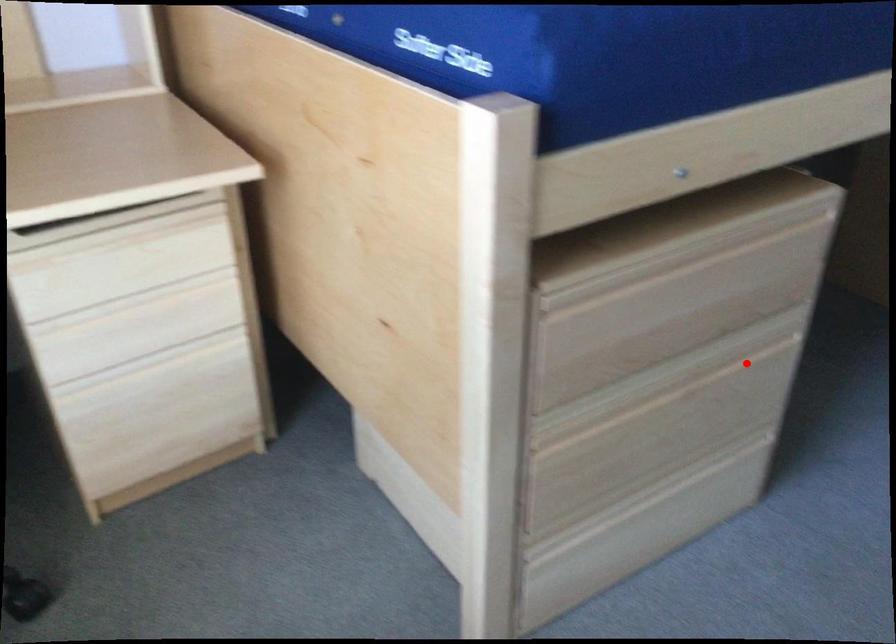
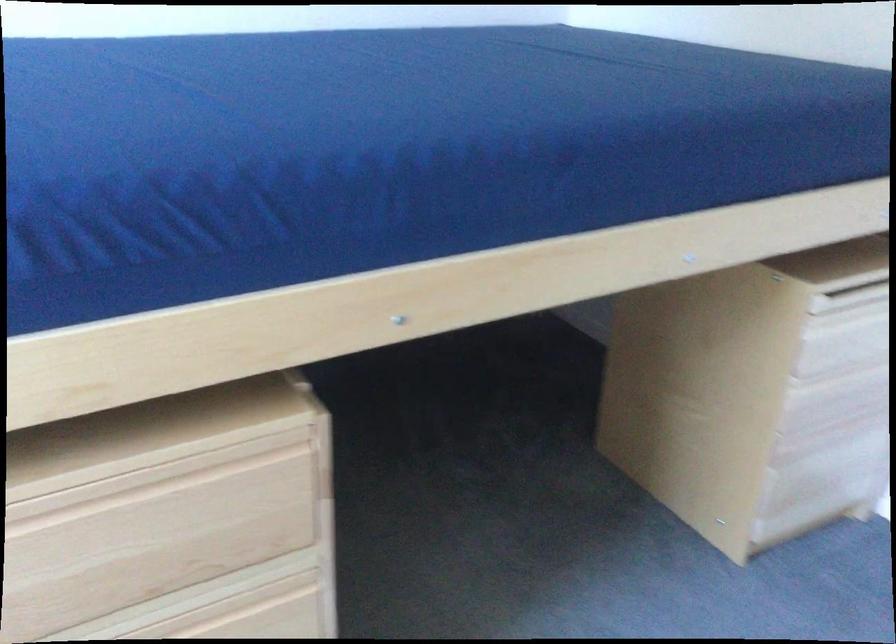
Question: I am providing you with two images of the same scene from different viewpoints. Image1 has a red point marked. In image2, the corresponding 3D location appears at what relative position? Reply with the corresponding letter.

Choices:
 (A) Closer
 (B) Farther

Answer: (A)